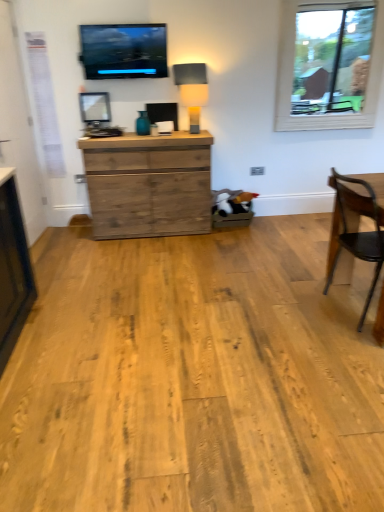
Find the location of a particular element. This screenshot has width=384, height=512. vacant space in front of matte beige lampshade at center is located at coordinates (188, 134).